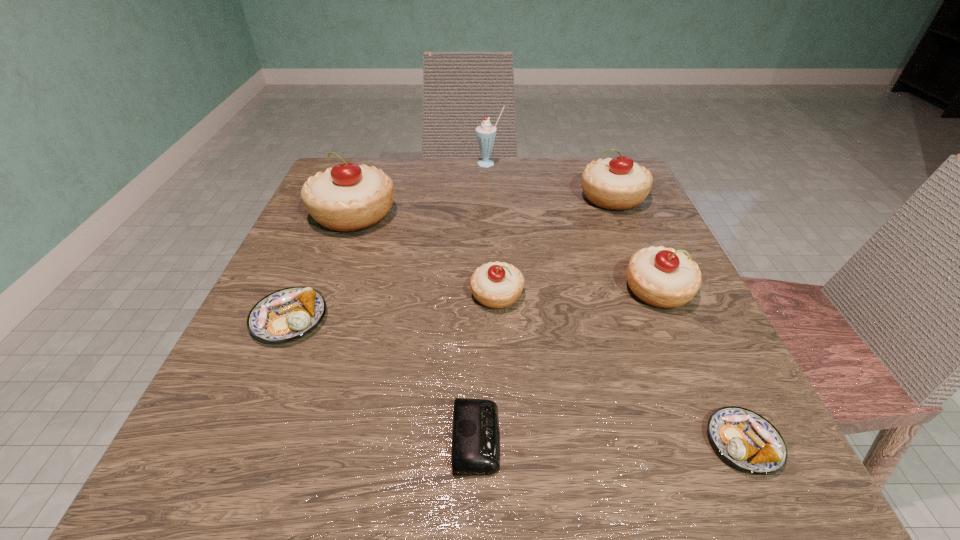
The width and height of the screenshot is (960, 540). I want to click on free area in between the third biggest beige pastry and the fourth tallest pastry, so click(x=578, y=292).

This screenshot has width=960, height=540. What are the coordinates of `blank region between the milkshake and the leftmost beige pastry` in the screenshot? It's located at (421, 188).

Locate an element on the screen. The height and width of the screenshot is (540, 960). free point between the fifth shortest pastry and the milkshake is located at coordinates (551, 180).

Where is `free space between the left brown pastry and the smaller brown pastry`? free space between the left brown pastry and the smaller brown pastry is located at coordinates (516, 381).

This screenshot has width=960, height=540. Find the location of `the fifth closest object relative to the white milkshake`. the fifth closest object relative to the white milkshake is located at coordinates (287, 314).

This screenshot has height=540, width=960. I want to click on object that ranks as the fourth closest to the third shortest pastry, so click(287, 314).

Find the location of a particular element. This screenshot has width=960, height=540. pastry that stands as the closest to the second biggest beige pastry is located at coordinates (662, 277).

Identify the location of pastry identified as the fifth closest to the second biggest beige pastry. The height and width of the screenshot is (540, 960). (287, 314).

Locate an element on the screen. the second closest beige pastry to the shortest object is located at coordinates (662, 277).

Locate an element on the screen. This screenshot has width=960, height=540. beige pastry that is the second closest one to the white milkshake is located at coordinates (348, 197).